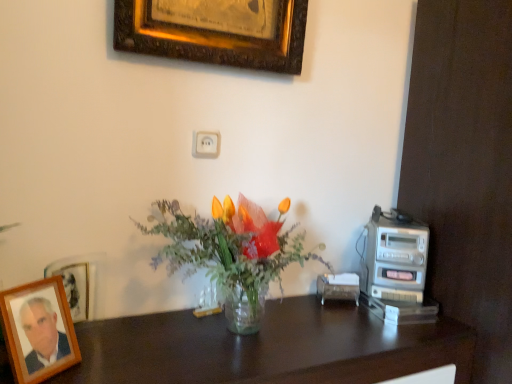
This screenshot has height=384, width=512. I want to click on vacant space in front of silver metallic stereo at right, so click(400, 333).